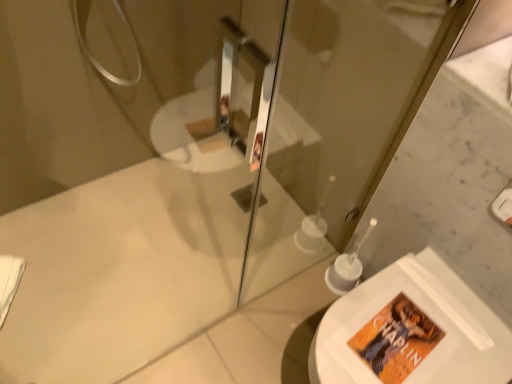
Question: Is the depth of transparent glass screen door at upper center greater than that of white glossy toilet at lower right?

Choices:
 (A) yes
 (B) no

Answer: (B)

Question: Is transparent glass screen door at upper center thinner than white glossy toilet at lower right?

Choices:
 (A) yes
 (B) no

Answer: (A)

Question: Is transparent glass screen door at upper center located outside white glossy toilet at lower right?

Choices:
 (A) no
 (B) yes

Answer: (B)

Question: Is the surface of transparent glass screen door at upper center in direct contact with white glossy toilet at lower right?

Choices:
 (A) no
 (B) yes

Answer: (A)

Question: Considering the relative sizes of transparent glass screen door at upper center and white glossy toilet at lower right in the image provided, is transparent glass screen door at upper center smaller than white glossy toilet at lower right?

Choices:
 (A) yes
 (B) no

Answer: (A)

Question: Is transparent glass screen door at upper center aimed at white glossy toilet at lower right?

Choices:
 (A) yes
 (B) no

Answer: (A)

Question: From a real-world perspective, is white glossy toilet at lower right positioned over transparent glass screen door at upper center based on gravity?

Choices:
 (A) yes
 (B) no

Answer: (B)

Question: Is white glossy toilet at lower right looking in the opposite direction of transparent glass screen door at upper center?

Choices:
 (A) yes
 (B) no

Answer: (B)

Question: Can you confirm if white glossy toilet at lower right is thinner than transparent glass screen door at upper center?

Choices:
 (A) no
 (B) yes

Answer: (A)

Question: Does white glossy toilet at lower right appear on the left side of transparent glass screen door at upper center?

Choices:
 (A) yes
 (B) no

Answer: (B)

Question: Does white glossy toilet at lower right lie in front of transparent glass screen door at upper center?

Choices:
 (A) yes
 (B) no

Answer: (B)

Question: From the image's perspective, is white glossy toilet at lower right above transparent glass screen door at upper center?

Choices:
 (A) no
 (B) yes

Answer: (A)

Question: Is white glossy toilet at lower right taller or shorter than transparent glass screen door at upper center?

Choices:
 (A) short
 (B) tall

Answer: (A)